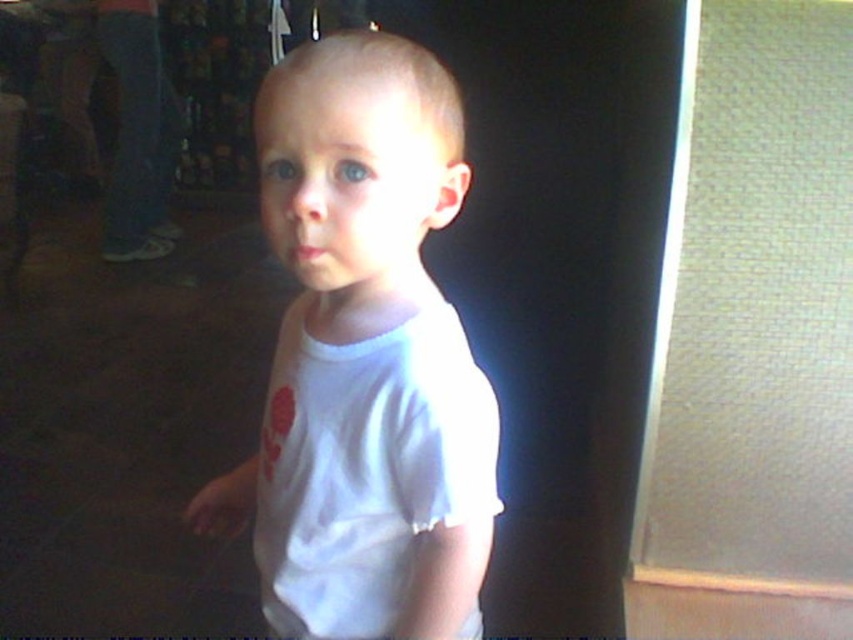
Question: Estimate the real-world distances between objects in this image. Which object is farther from the white matte shirt at center?

Choices:
 (A) white cotton t-shirt at center
 (B) white cotton shirt at center

Answer: (A)

Question: Is white cotton t-shirt at center wider than white matte shirt at center?

Choices:
 (A) yes
 (B) no

Answer: (B)

Question: Which point appears closest to the camera in this image?

Choices:
 (A) (144, 161)
 (B) (450, 189)

Answer: (B)

Question: Does white cotton t-shirt at center appear under white matte shirt at center?

Choices:
 (A) yes
 (B) no

Answer: (A)

Question: Among these objects, which one is nearest to the camera?

Choices:
 (A) white cotton shirt at center
 (B) white matte shirt at center
 (C) white cotton t-shirt at center

Answer: (A)

Question: Does white cotton shirt at center appear on the right side of white matte shirt at center?

Choices:
 (A) yes
 (B) no

Answer: (A)